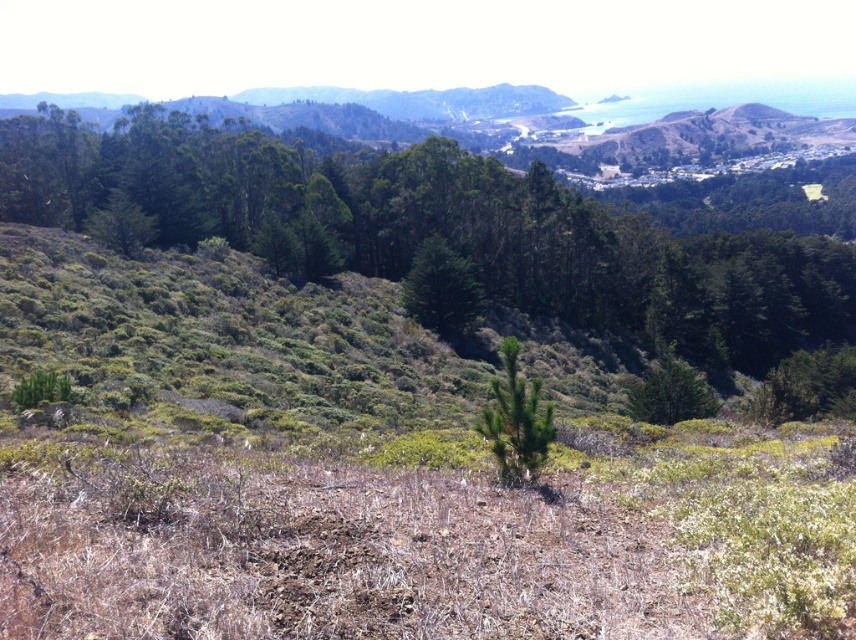
You are standing at the point with coordinates point (520,381) and want to walk towards the point with coordinates point (710,408). Based on the scene description, will you have an unobstructed path? Explain your reasoning.

The point (520,381) is in front of point (710,408). Since you are already at the point in front, moving towards the point behind would require navigating through the dense cluster of tall trees in the middle ground, which may obstruct the path. Therefore, the path is likely obstructed by the forested area.

You are an environmental scientist assessing the health of this landscape. You observe the green leafy tree at upper center and the green leafy tree at center. Which tree might indicate better health based on its size?

The green leafy tree at upper center is larger in size than the green leafy tree at center, suggesting it may be healthier.

You are an environmental scientist assessing the health of a forest. You observe two green leafy trees in the scene. Which tree has a wider canopy? The options are the green leafy tree at upper center and the green leafy tree at center.

The green leafy tree at upper center has a wider canopy than the green leafy tree at center.